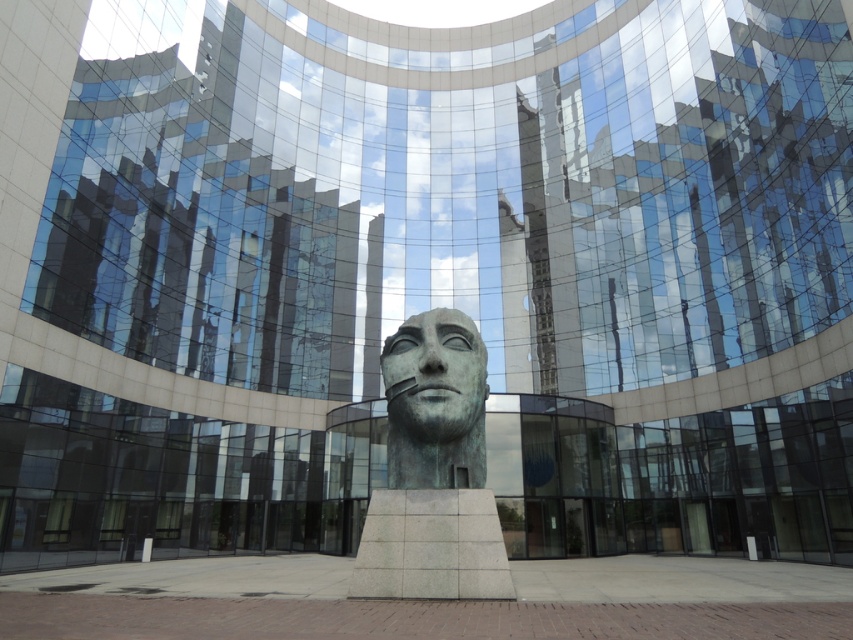
Based on the coordinates provided, where is the green patina bronze head at center located in the image?

The green patina bronze head at center is located at the coordinates point (433, 472).

You are standing in front of the modern architectural structure and want to walk from point A to point B. Point A is at coordinates point (410, 317) and point B is at coordinates point (438, 417). Which point is closer to you when you are facing the building?

Point (438, 417) is closer to you because point (410, 317) is behind it.

You are an art curator planning to install a new exhibit in the modern architectural structure. You need to ensure that the green patina bronze head at center and the bronze statue at center are spaced at least 8 centimeters apart for safety. Based on the image, will the current spacing between them meet the requirement?

The green patina bronze head at center and the bronze statue at center are 7.93 centimeters apart from each other, which is slightly less than the required 8 centimeters. Therefore, the current spacing does not meet the safety requirement.